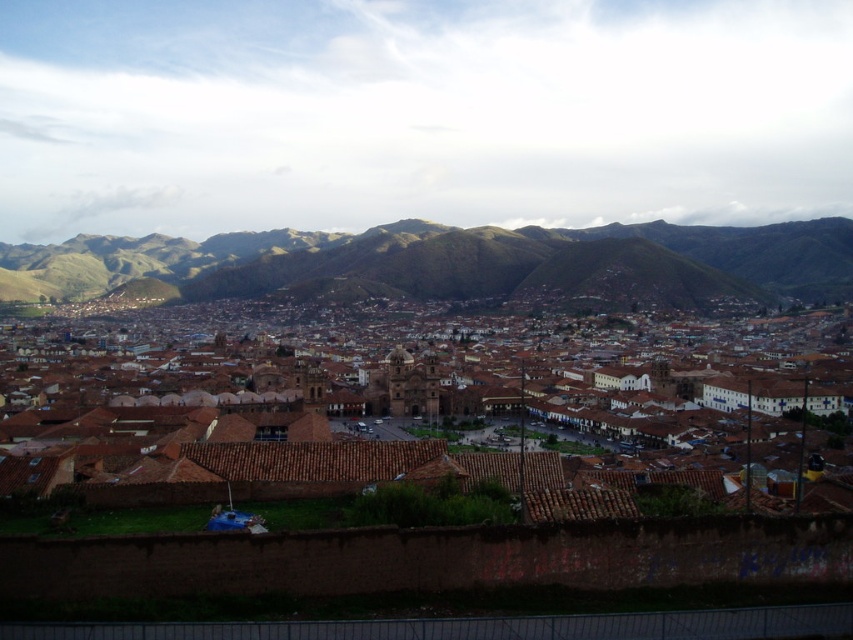
Is brown tile roofs at center wider than green grassy hill at center?

Incorrect, brown tile roofs at center's width does not surpass green grassy hill at center's.

Can you confirm if brown tile roofs at center is positioned above green grassy hill at center?

Actually, brown tile roofs at center is below green grassy hill at center.

Which is behind, point (558, 420) or point (663, 266)?

Positioned behind is point (663, 266).

You are a GUI agent. You are given a task and a screenshot of the screen. Output one action in this format:
    pyautogui.click(x=<x>, y=<y>)
    Task: Click on the brown tile roofs at center
    
    Given the screenshot: What is the action you would take?
    pyautogui.click(x=434, y=448)